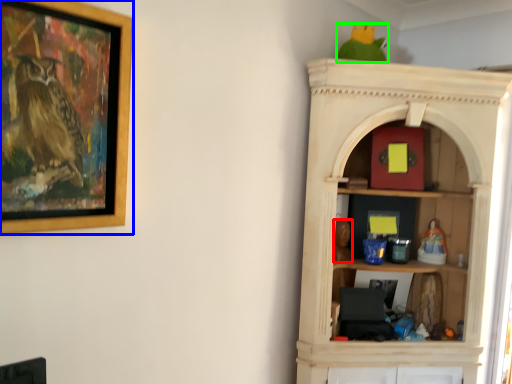
Question: Which object is the closest to the toy (highlighted by a red box)? Choose among these: picture frame (highlighted by a blue box) or parrot (highlighted by a green box).

Choices:
 (A) picture frame
 (B) parrot

Answer: (B)